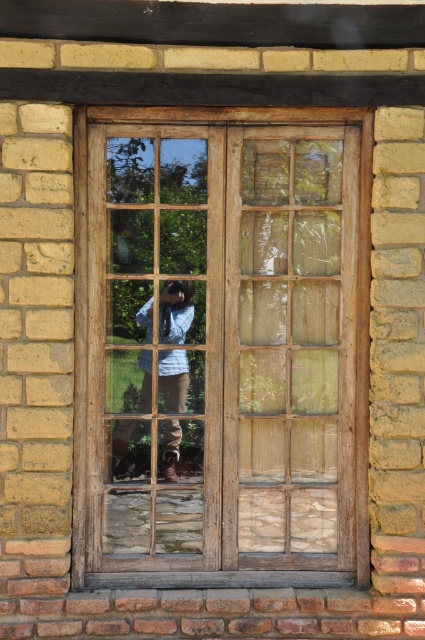
Question: Considering the relative positions of wooden window frame at center and blue denim shirt at center in the image provided, where is wooden window frame at center located with respect to blue denim shirt at center?

Choices:
 (A) above
 (B) below

Answer: (A)

Question: Which of the following is the farthest from the observer?

Choices:
 (A) blue denim shirt at center
 (B) wooden window frame at center

Answer: (A)

Question: From the image, what is the correct spatial relationship of wooden window frame at center in relation to blue denim shirt at center?

Choices:
 (A) right
 (B) left

Answer: (A)

Question: Can you confirm if wooden window frame at center is positioned to the left of blue denim shirt at center?

Choices:
 (A) no
 (B) yes

Answer: (A)

Question: Which point is farther to the camera?

Choices:
 (A) (170, 426)
 (B) (135, 452)

Answer: (A)